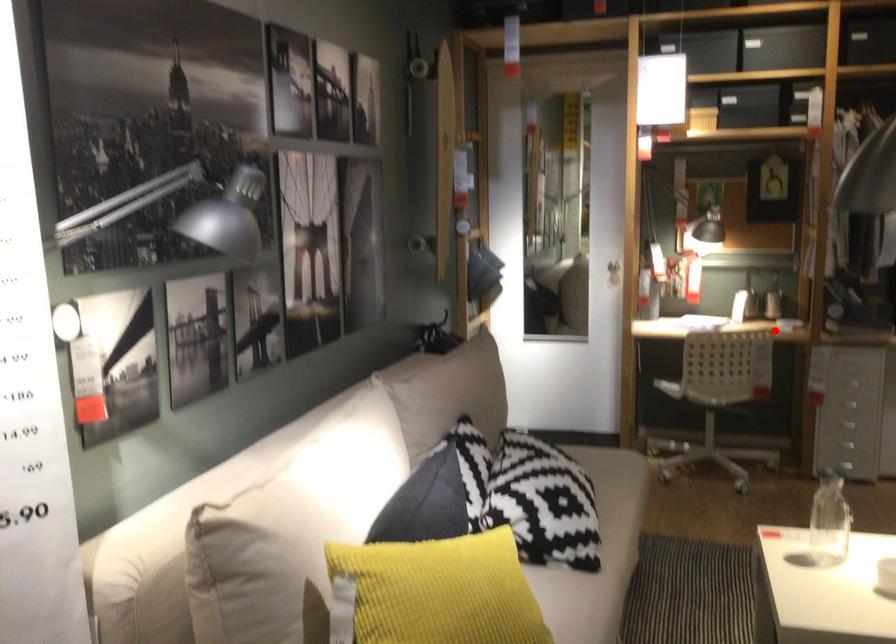
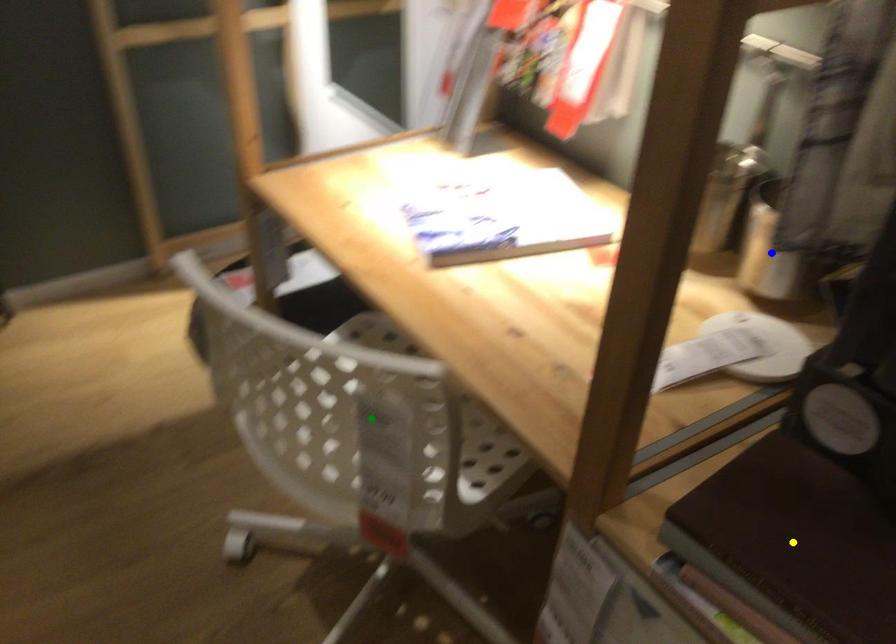
Question: I am providing you with two images of the same scene from different viewpoints. A red point is marked on the first image. You are given multiple points on the second image. Which point in image 2 represents the same 3d spot as the red point in image 1?

Choices:
 (A) yellow point
 (B) green point
 (C) blue point

Answer: (B)